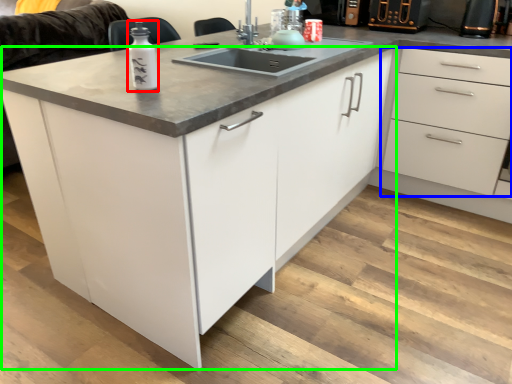
Question: Based on their relative distances, which object is nearer to bottle (highlighted by a red box)? Choose from drawer (highlighted by a blue box) and cabinetry (highlighted by a green box).

Choices:
 (A) drawer
 (B) cabinetry

Answer: (B)